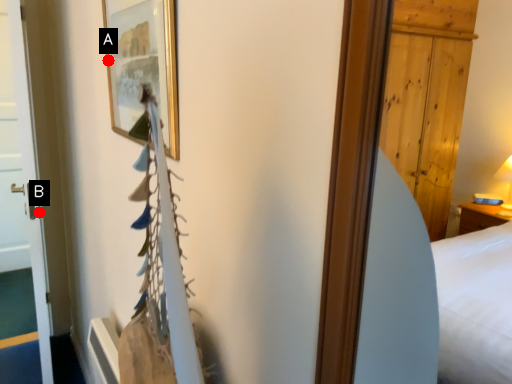
Question: Two points are circled on the image, labeled by A and B beside each circle. Which point is further to the camera?

Choices:
 (A) A is further
 (B) B is further

Answer: (B)